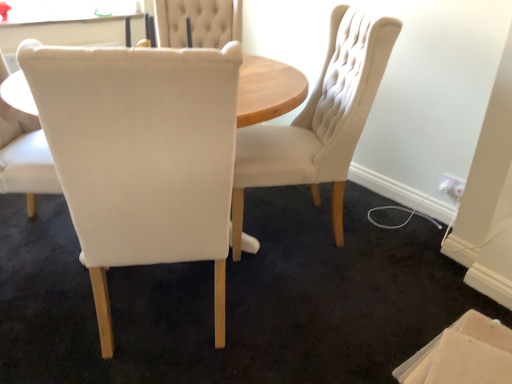
I want to click on matte white chair at center, the second chair when ordered from right to left, so click(141, 155).

Are matte cream chair at center, which appears as the third chair when viewed from the left, and matte white chair at center, the second chair when ordered from right to left, beside each other?

They are not placed beside each other.

Is matte cream chair at center, which appears as the third chair when viewed from the left, taller or shorter than matte white chair at center, the second chair when ordered from right to left?

Considering their sizes, matte cream chair at center, which appears as the third chair when viewed from the left, has less height than matte white chair at center, the second chair when ordered from right to left.

Is matte cream chair at center, which appears as the third chair when viewed from the left, bigger than matte white chair at center, the second chair when ordered from right to left?

No, matte cream chair at center, which appears as the third chair when viewed from the left, is not bigger than matte white chair at center, the second chair when ordered from right to left.

Is matte cream chair at center, arranged as the first chair when viewed from the right, at the left side of matte white chair at center, acting as the second chair starting from the left?

No.

From the picture: Considering the sizes of objects beige cardboard box at lower right and matte white chair at center, acting as the second chair starting from the left, in the image provided, who is thinner, beige cardboard box at lower right or matte white chair at center, acting as the second chair starting from the left,?

beige cardboard box at lower right.

Can you tell me how much beige cardboard box at lower right and matte white chair at center, the second chair when ordered from right to left, differ in facing direction?

beige cardboard box at lower right and matte white chair at center, the second chair when ordered from right to left, are facing 140 degrees away from each other.

From a real-world perspective, which object stands above the other?

matte white chair at center, acting as the second chair starting from the left.

Could you measure the distance between beige cardboard box at lower right and matte white chair at center, acting as the second chair starting from the left?

beige cardboard box at lower right is 36.14 inches away from matte white chair at center, acting as the second chair starting from the left.

From their relative heights in the image, would you say matte white chair at center, acting as the second chair starting from the left, is taller or shorter than beige cardboard box at lower right?

Considering their sizes, matte white chair at center, acting as the second chair starting from the left, has more height than beige cardboard box at lower right.

Considering their positions, is matte white chair at center, acting as the second chair starting from the left, located in front of or behind beige cardboard box at lower right?

Visually, matte white chair at center, acting as the second chair starting from the left, is located in front of beige cardboard box at lower right.

What's the angular difference between matte white chair at center, the second chair when ordered from right to left, and beige cardboard box at lower right's facing directions?

140 degrees separate the facing orientations of matte white chair at center, the second chair when ordered from right to left, and beige cardboard box at lower right.

Considering the positions of objects matte white chair at center, the second chair when ordered from right to left, and beige cardboard box at lower right in the image provided, who is more to the right, matte white chair at center, the second chair when ordered from right to left, or beige cardboard box at lower right?

beige cardboard box at lower right is more to the right.

Are matte cream chair at center, arranged as the first chair when viewed from the right, and white fabric chair at center, which appears as the 3th chair when viewed from the right, located far from each other?

Yes, matte cream chair at center, arranged as the first chair when viewed from the right, is far from white fabric chair at center, which appears as the 3th chair when viewed from the right.

Measure the distance between matte cream chair at center, arranged as the first chair when viewed from the right, and white fabric chair at center, the first chair when ordered from left to right.

matte cream chair at center, arranged as the first chair when viewed from the right, is 3.33 feet from white fabric chair at center, the first chair when ordered from left to right.

Is matte cream chair at center, which appears as the third chair when viewed from the left, looking in the opposite direction of white fabric chair at center, the first chair when ordered from left to right?

No, matte cream chair at center, which appears as the third chair when viewed from the left, is not facing the opposite direction of white fabric chair at center, the first chair when ordered from left to right.

Is white fabric chair at center, which appears as the 3th chair when viewed from the right, far from matte white chair at center, the second chair when ordered from right to left?

No, white fabric chair at center, which appears as the 3th chair when viewed from the right, is not far away from matte white chair at center, the second chair when ordered from right to left.

Is matte white chair at center, the second chair when ordered from right to left, a part of white fabric chair at center, which appears as the 3th chair when viewed from the right?

No.

Locate an element on the screen. The width and height of the screenshot is (512, 384). chair that appears below the white fabric chair at center, the first chair when ordered from left to right (from the image's perspective) is located at coordinates (141, 155).

Does point (9, 101) appear closer or farther from the camera than point (149, 241)?

Clearly, point (9, 101) is more distant from the camera than point (149, 241).

Is white fabric chair at center, the first chair when ordered from left to right, aimed at matte cream chair at center, arranged as the first chair when viewed from the right?

Yes.

Locate an element on the screen. Image resolution: width=512 pixels, height=384 pixels. chair that is under the white fabric chair at center, the first chair when ordered from left to right (from a real-world perspective) is located at coordinates (319, 120).

From the image's perspective, does white fabric chair at center, which appears as the 3th chair when viewed from the right, appear higher than matte cream chair at center, which appears as the third chair when viewed from the left?

No, from the image's perspective, white fabric chair at center, which appears as the 3th chair when viewed from the right, is not above matte cream chair at center, which appears as the third chair when viewed from the left.

Who is smaller, white fabric chair at center, which appears as the 3th chair when viewed from the right, or beige cardboard box at lower right?

beige cardboard box at lower right.

Is white fabric chair at center, the first chair when ordered from left to right, taller or shorter than beige cardboard box at lower right?

Clearly, white fabric chair at center, the first chair when ordered from left to right, is taller compared to beige cardboard box at lower right.

Is white fabric chair at center, the first chair when ordered from left to right, oriented away from beige cardboard box at lower right?

No, white fabric chair at center, the first chair when ordered from left to right, is not facing away from beige cardboard box at lower right.

This screenshot has width=512, height=384. I want to click on the 2nd chair directly above the matte cream chair at center, which appears as the third chair when viewed from the left (from a real-world perspective), so click(141, 155).

I want to click on cardboard box that is behind the matte white chair at center, acting as the second chair starting from the left, so [463, 354].

Which object lies nearer to the anchor point matte white chair at center, acting as the second chair starting from the left, white fabric chair at center, which appears as the 3th chair when viewed from the right, or matte cream chair at center, which appears as the third chair when viewed from the left?

The object closer to matte white chair at center, acting as the second chair starting from the left, is white fabric chair at center, which appears as the 3th chair when viewed from the right.

From the picture: Looking at the image, which one is located closer to matte cream chair at center, arranged as the first chair when viewed from the right, beige cardboard box at lower right or matte white chair at center, acting as the second chair starting from the left?

Based on the image, matte white chair at center, acting as the second chair starting from the left, appears to be nearer to matte cream chair at center, arranged as the first chair when viewed from the right.

When comparing their distances from white fabric chair at center, the first chair when ordered from left to right, does matte cream chair at center, which appears as the third chair when viewed from the left, or matte white chair at center, the second chair when ordered from right to left, seem closer?

The object closer to white fabric chair at center, the first chair when ordered from left to right, is matte white chair at center, the second chair when ordered from right to left.

Which object lies further to the anchor point matte cream chair at center, arranged as the first chair when viewed from the right, beige cardboard box at lower right or white fabric chair at center, which appears as the 3th chair when viewed from the right?

The object further to matte cream chair at center, arranged as the first chair when viewed from the right, is white fabric chair at center, which appears as the 3th chair when viewed from the right.

Which object lies nearer to the anchor point beige cardboard box at lower right, matte white chair at center, the second chair when ordered from right to left, or matte cream chair at center, arranged as the first chair when viewed from the right?

matte cream chair at center, arranged as the first chair when viewed from the right, is positioned closer to the anchor beige cardboard box at lower right.

Looking at the image, which one is located closer to beige cardboard box at lower right, matte cream chair at center, arranged as the first chair when viewed from the right, or matte white chair at center, the second chair when ordered from right to left?

matte cream chair at center, arranged as the first chair when viewed from the right, lies closer to beige cardboard box at lower right than the other object.

Based on their spatial positions, is white fabric chair at center, which appears as the 3th chair when viewed from the right, or matte cream chair at center, which appears as the third chair when viewed from the left, closer to beige cardboard box at lower right?

matte cream chair at center, which appears as the third chair when viewed from the left, lies closer to beige cardboard box at lower right than the other object.

When comparing their distances from matte white chair at center, acting as the second chair starting from the left, does beige cardboard box at lower right or matte cream chair at center, which appears as the third chair when viewed from the left, seem closer?

matte cream chair at center, which appears as the third chair when viewed from the left, is closer to matte white chair at center, acting as the second chair starting from the left.

Find the location of a particular element. The width and height of the screenshot is (512, 384). chair between matte white chair at center, the second chair when ordered from right to left, and beige cardboard box at lower right from left to right is located at coordinates (319, 120).

Image resolution: width=512 pixels, height=384 pixels. I want to click on chair between white fabric chair at center, the first chair when ordered from left to right, and matte cream chair at center, arranged as the first chair when viewed from the right, so click(141, 155).